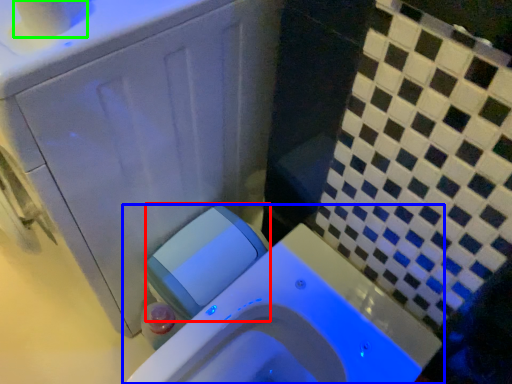
Question: Estimate the real-world distances between objects in this image. Which object is closer to water tank (highlighted by a red box), toilet (highlighted by a blue box) or toilet paper (highlighted by a green box)?

Choices:
 (A) toilet
 (B) toilet paper

Answer: (A)